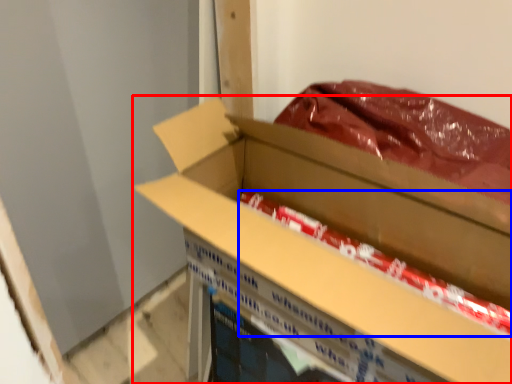
Question: Which of the following is the closest to the observer, box (highlighted by a red box) or wrapping paper (highlighted by a blue box)?

Choices:
 (A) box
 (B) wrapping paper

Answer: (A)